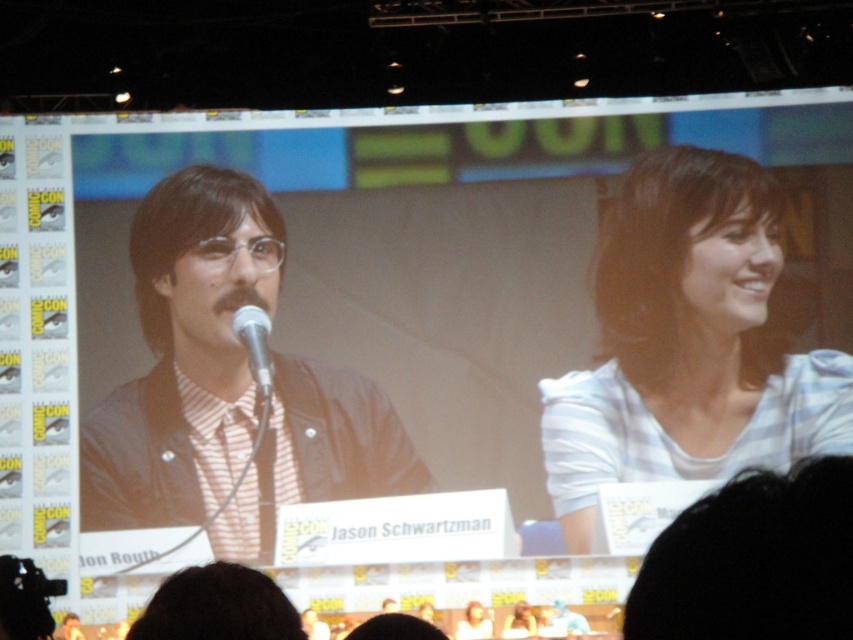
You are attending a Comic Con panel and want to locate the matte black jacket at left. According to the coordinates provided, where exactly would you look on the image?

You should look at point 0.605 on the x axis and 0.266 on the y axis to find the matte black jacket at left.

You are attending a Comic Con panel and want to know which object is larger between the white striped shirt at upper right and the silver metallic microphone at center. Can you tell me which one is bigger?

The white striped shirt at upper right is bigger than the silver metallic microphone at center.